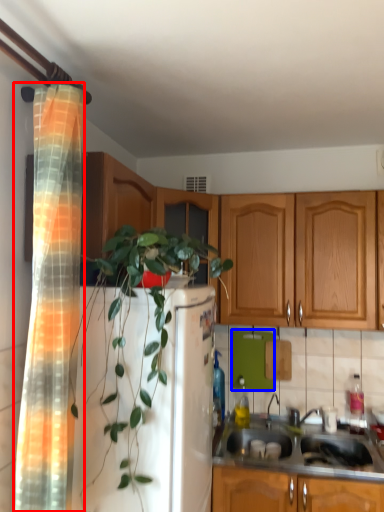
Question: Among these objects, which one is nearest to the camera, shower curtain (highlighted by a red box) or appliance (highlighted by a blue box)?

Choices:
 (A) shower curtain
 (B) appliance

Answer: (A)